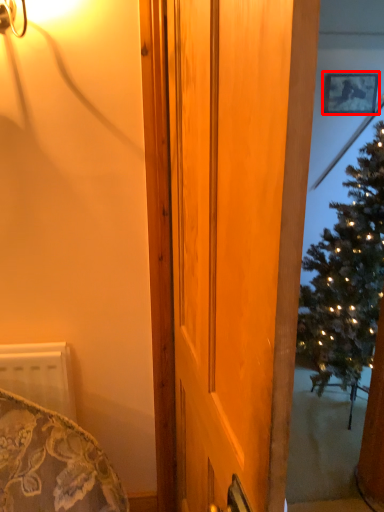
Question: Observing the image, what is the correct spatial positioning of picture frame (annotated by the red box) in reference to door?

Choices:
 (A) right
 (B) left

Answer: (A)